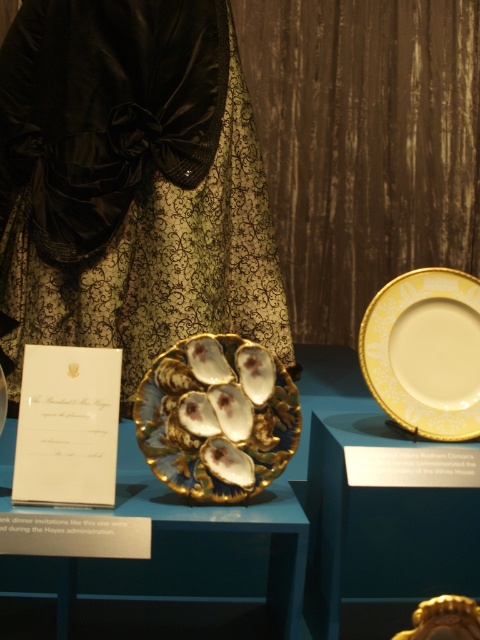
You are a museum visitor standing in front of the display. You want to take a photo of the black satin dress at center without moving any items. Can you get a clear photo of it from your current position?

The black satin dress at center is 7.88 feet away from camera, so yes, you can get a clear photo of the black satin dress at center from your current position as it is within a reasonable distance for photography.